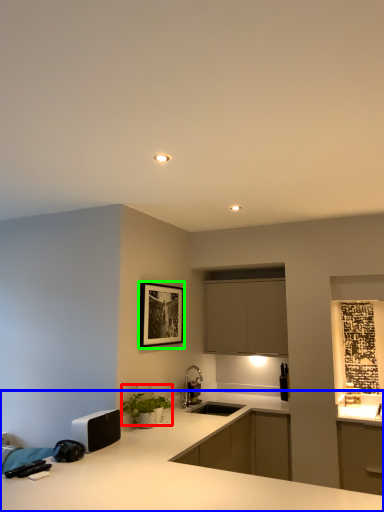
Question: Based on their relative distances, which object is farther from plant (highlighted by a red box)? Choose from countertop (highlighted by a blue box) and picture frame (highlighted by a green box).

Choices:
 (A) countertop
 (B) picture frame

Answer: (A)